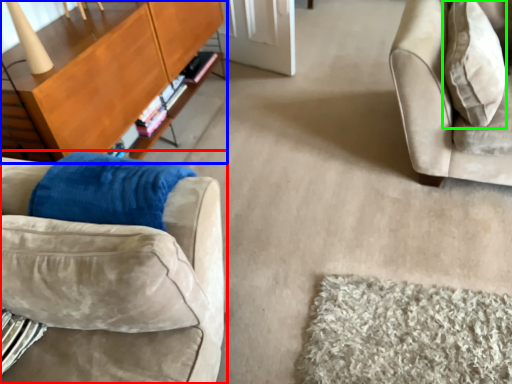
Question: Which object is positioned closest to studio couch (highlighted by a red box)? Select from table (highlighted by a blue box) and throw pillow (highlighted by a green box).

Choices:
 (A) table
 (B) throw pillow

Answer: (A)